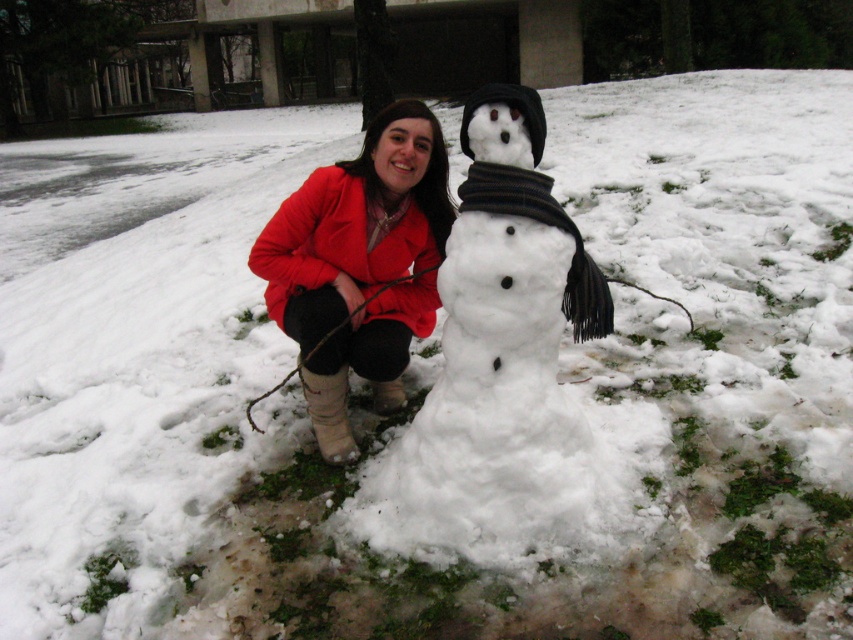
Is point (363, 262) closer to viewer compared to point (287, 257)?

No.

Is matte red coat at center positioned at the back of red matte jacket at center?

No, it is in front of red matte jacket at center.

Which is in front, point (299, 202) or point (422, 240)?

Point (299, 202) is more forward.

At what (x,y) coordinates should I click in order to perform the action: click on matte red coat at center. Please return your answer as a coordinate pair (x, y). The width and height of the screenshot is (853, 640). Looking at the image, I should click on (358, 266).

Measure the distance from white fluffy snowman at center to matte red coat at center.

14.68 inches

This screenshot has width=853, height=640. Find the location of `white fluffy snowman at center`. white fluffy snowman at center is located at coordinates (500, 368).

Does point (608, 316) come closer to viewer compared to point (323, 237)?

Yes, point (608, 316) is in front of point (323, 237).

At what (x,y) coordinates should I click in order to perform the action: click on white fluffy snowman at center. Please return your answer as a coordinate pair (x, y). This screenshot has width=853, height=640. Looking at the image, I should click on (500, 368).

Is white fluffy snowman at center further to camera compared to red matte jacket at center?

No.

How far apart are white fluffy snowman at center and red matte jacket at center?

white fluffy snowman at center and red matte jacket at center are 19.63 inches apart from each other.

The height and width of the screenshot is (640, 853). Describe the element at coordinates (500, 368) in the screenshot. I see `white fluffy snowman at center` at that location.

This screenshot has height=640, width=853. What are the coordinates of `white fluffy snowman at center` in the screenshot? It's located at (500, 368).